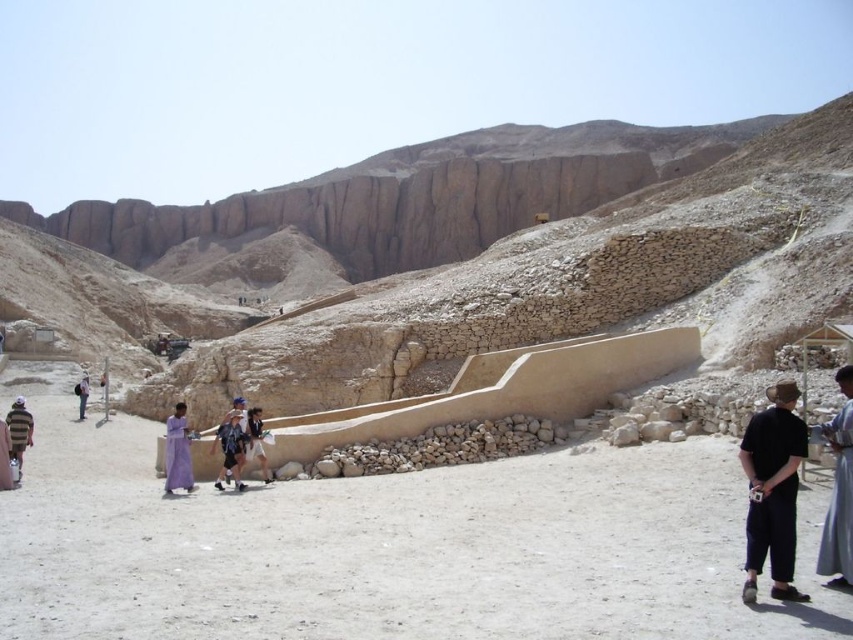
You are a photographer planning to capture a photo of the desert archaeological site. You want to ensure both the purple fabric dress at lower left and the dark blue jeans at center are visible in the frame. Which object should you focus on to ensure both are in the shot?

The purple fabric dress at lower left is larger in size compared to the dark blue jeans at center, so focusing on the purple fabric dress at lower left will help ensure both are visible in the frame.

You are a photographer trying to capture both the black cotton shirt at lower right and the dark blue jeans at center in a single frame. Which item will appear larger in your photo?

The black cotton shirt at lower right will appear larger in the photo since it is bigger than the dark blue jeans at center.